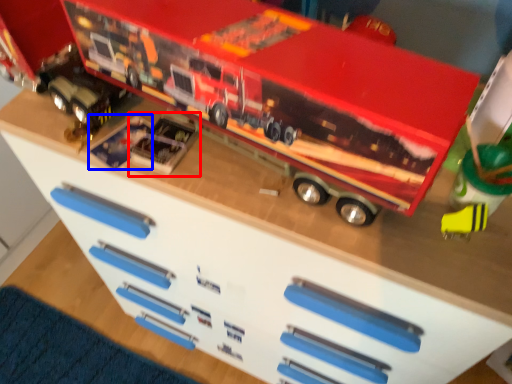
Question: Which object appears closest to the camera in this image, toy (highlighted by a red box) or toy (highlighted by a blue box)?

Choices:
 (A) toy
 (B) toy

Answer: (A)